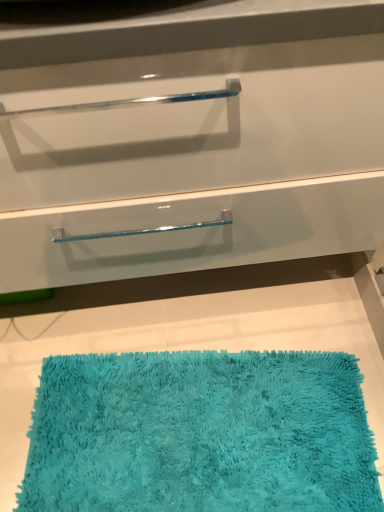
You are a GUI agent. You are given a task and a screenshot of the screen. Output one action in this format:
    pyautogui.click(x=<x>, y=<y>)
    Task: Click on the clear glass drawer at center
    This screenshot has width=384, height=512.
    Given the screenshot: What is the action you would take?
    pyautogui.click(x=193, y=122)

What do you see at coordinates (193, 122) in the screenshot? I see `clear glass drawer at center` at bounding box center [193, 122].

Find the location of `turquoise shaggy bath mat at lower center`. turquoise shaggy bath mat at lower center is located at coordinates (200, 434).

What do you see at coordinates (200, 434) in the screenshot?
I see `turquoise shaggy bath mat at lower center` at bounding box center [200, 434].

Identify the location of clear glass drawer at center. The image size is (384, 512). (193, 122).

Is clear glass drawer at center at the right side of turquoise shaggy bath mat at lower center?

No.

Is clear glass drawer at center in front of or behind turquoise shaggy bath mat at lower center in the image?

Clearly, clear glass drawer at center is in front of turquoise shaggy bath mat at lower center.

Considering the positions of point (381, 115) and point (275, 405), is point (381, 115) closer or farther from the camera than point (275, 405)?

Point (381, 115) is closer to the camera than point (275, 405).

From the image's perspective, is clear glass drawer at center located above or below turquoise shaggy bath mat at lower center?

clear glass drawer at center is above turquoise shaggy bath mat at lower center.

From a real-world perspective, which object rests below the other?

In real-world perspective, turquoise shaggy bath mat at lower center is lower.

Considering the relative sizes of clear glass drawer at center and turquoise shaggy bath mat at lower center in the image provided, is clear glass drawer at center wider than turquoise shaggy bath mat at lower center?

No, clear glass drawer at center is not wider than turquoise shaggy bath mat at lower center.

Can you confirm if clear glass drawer at center is taller than turquoise shaggy bath mat at lower center?

Yes, clear glass drawer at center is taller than turquoise shaggy bath mat at lower center.

In terms of size, does clear glass drawer at center appear bigger or smaller than turquoise shaggy bath mat at lower center?

Considering their sizes, clear glass drawer at center takes up more space than turquoise shaggy bath mat at lower center.

Would you say turquoise shaggy bath mat at lower center is part of clear glass drawer at center's contents?

No, turquoise shaggy bath mat at lower center is not a part of clear glass drawer at center.

Is there a large distance between clear glass drawer at center and turquoise shaggy bath mat at lower center?

clear glass drawer at center is actually quite close to turquoise shaggy bath mat at lower center.

Is clear glass drawer at center oriented towards turquoise shaggy bath mat at lower center?

Yes, clear glass drawer at center is turned towards turquoise shaggy bath mat at lower center.

Find the location of `bath mat directly beneath the clear glass drawer at center (from a real-world perspective)`. bath mat directly beneath the clear glass drawer at center (from a real-world perspective) is located at coordinates (200, 434).

Considering the positions of objects turquoise shaggy bath mat at lower center and clear glass drawer at center in the image provided, who is more to the right, turquoise shaggy bath mat at lower center or clear glass drawer at center?

turquoise shaggy bath mat at lower center is more to the right.

Which object is further away from the camera taking this photo, turquoise shaggy bath mat at lower center or clear glass drawer at center?

turquoise shaggy bath mat at lower center.

Does point (76, 402) appear closer or farther from the camera than point (239, 110)?

Point (76, 402) appears to be farther away from the viewer than point (239, 110).

From the image's perspective, which one is positioned higher, turquoise shaggy bath mat at lower center or clear glass drawer at center?

clear glass drawer at center, from the image's perspective.

From a real-world perspective, is turquoise shaggy bath mat at lower center positioned under clear glass drawer at center based on gravity?

Correct, in the physical world, turquoise shaggy bath mat at lower center is lower than clear glass drawer at center.

In terms of width, does turquoise shaggy bath mat at lower center look wider or thinner when compared to clear glass drawer at center?

Considering their sizes, turquoise shaggy bath mat at lower center looks broader than clear glass drawer at center.

Who is taller, turquoise shaggy bath mat at lower center or clear glass drawer at center?

Standing taller between the two is clear glass drawer at center.

Considering the sizes of objects turquoise shaggy bath mat at lower center and clear glass drawer at center in the image provided, who is bigger, turquoise shaggy bath mat at lower center or clear glass drawer at center?

clear glass drawer at center.

Is turquoise shaggy bath mat at lower center outside of clear glass drawer at center?

Absolutely, turquoise shaggy bath mat at lower center is external to clear glass drawer at center.

Is turquoise shaggy bath mat at lower center with clear glass drawer at center?

turquoise shaggy bath mat at lower center and clear glass drawer at center are not in contact.

Is turquoise shaggy bath mat at lower center facing towards clear glass drawer at center?

No, turquoise shaggy bath mat at lower center does not turn towards clear glass drawer at center.

The height and width of the screenshot is (512, 384). I want to click on drawer lying in front of the turquoise shaggy bath mat at lower center, so click(193, 122).

At what (x,y) coordinates should I click in order to perform the action: click on bath mat that is on the right side of clear glass drawer at center. Please return your answer as a coordinate pair (x, y). The width and height of the screenshot is (384, 512). Looking at the image, I should click on (200, 434).

Where is `bath mat below the clear glass drawer at center (from the image's perspective)`? The image size is (384, 512). bath mat below the clear glass drawer at center (from the image's perspective) is located at coordinates (200, 434).